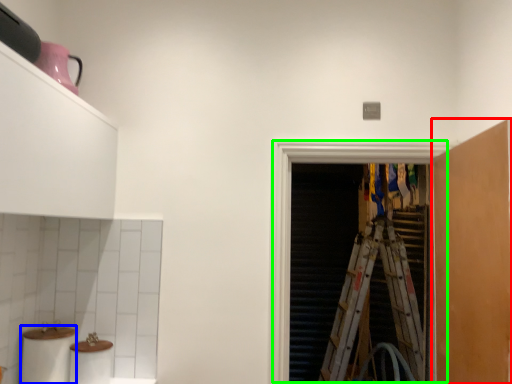
Question: Which object is positioned farthest from cabinetry (highlighted by a red box)? Select from toilet paper (highlighted by a blue box) and screen door (highlighted by a green box).

Choices:
 (A) toilet paper
 (B) screen door

Answer: (A)